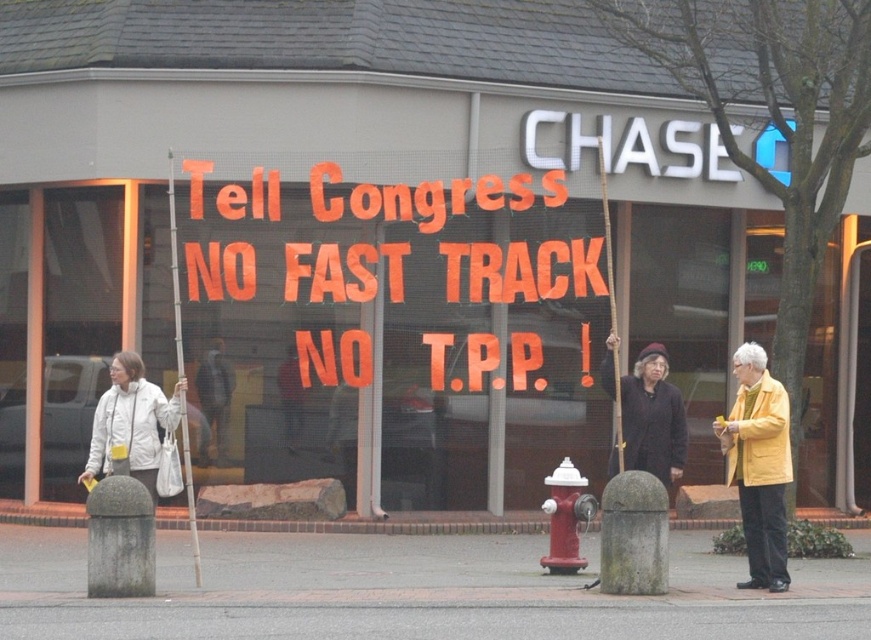
You are a delivery person who needs to place a 5 feet long package between the dark gray jacket at center and the metallic ladder at left. Is there enough space between them to fit the package?

The dark gray jacket at center is 4.08 feet away from the metallic ladder at left. Since the package is 5 feet long, it will not fit between them as the distance is shorter than the package length.

You are a photographer trying to capture the protest scene. You notice the dark gray jacket at center and the metallic ladder at left. Which object should you zoom in on to get a closer look without moving your camera, considering their sizes?

The dark gray jacket at center is wider than the metallic ladder at left, so zooming in on the dark gray jacket at center would allow you to capture more details without moving the camera.

You are a delivery person who needs to place a 15 feet long package between the black wool coat at center and the metallic ladder at left. Can you fit the package between them without moving either object?

The black wool coat at center and the metallic ladder at left are 16.87 feet apart from each other. Since the package is 15 feet long, it can fit between them as the distance is sufficient.